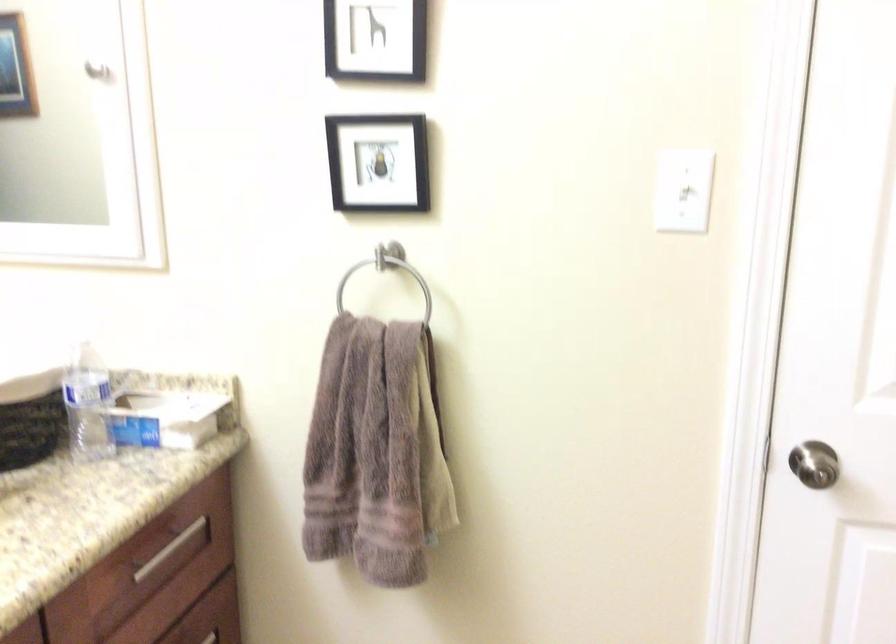
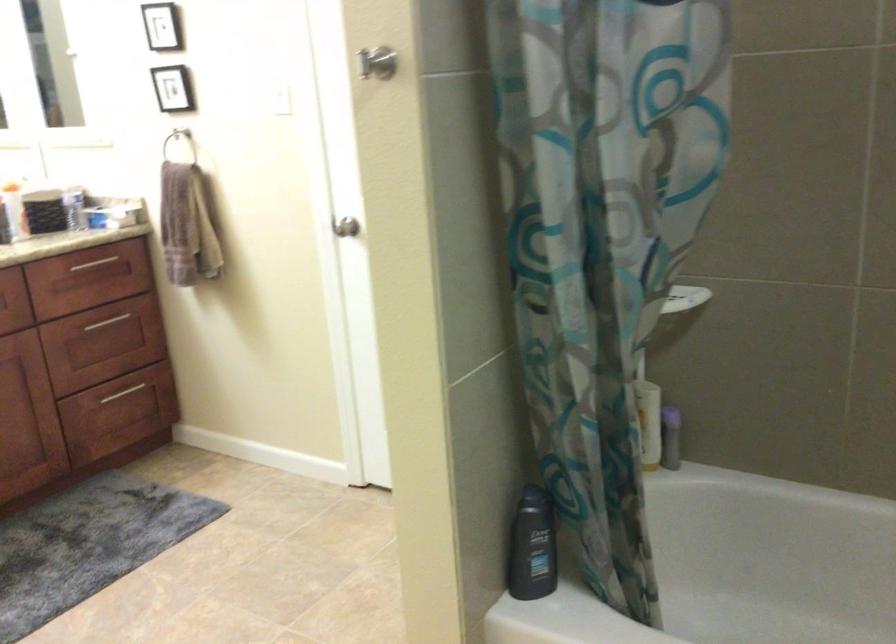
Locate, in the second image, the point that corresponds to (x=347, y=277) in the first image.

(177, 138)